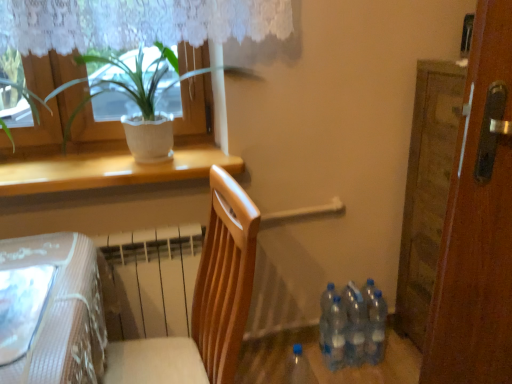
Find the location of `vacant space situated above white matte window sill at upper left (from a real-world perspective)`. vacant space situated above white matte window sill at upper left (from a real-world perspective) is located at coordinates (132, 158).